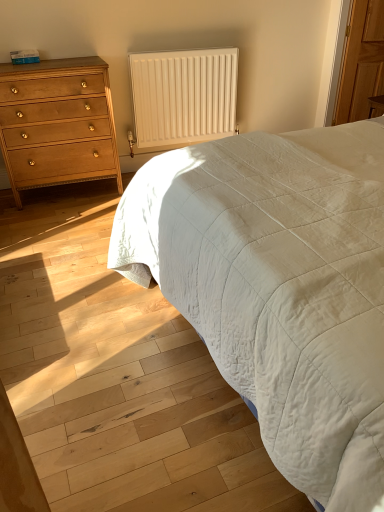
Question: Considering the positions of point (66, 133) and point (142, 138), is point (66, 133) closer or farther from the camera than point (142, 138)?

Choices:
 (A) closer
 (B) farther

Answer: (A)

Question: Considering their positions, is matte wood chest of drawers at left located in front of or behind white matte radiator at upper center?

Choices:
 (A) behind
 (B) front

Answer: (B)

Question: Considering the real-world distances, which object is closest to the white matte radiator at upper center?

Choices:
 (A) wooden armoire at right
 (B) white quilted fabric at center
 (C) matte wood chest of drawers at left

Answer: (C)

Question: Which object is positioned farthest from the white matte radiator at upper center?

Choices:
 (A) white quilted fabric at center
 (B) wooden armoire at right
 (C) matte wood chest of drawers at left

Answer: (A)